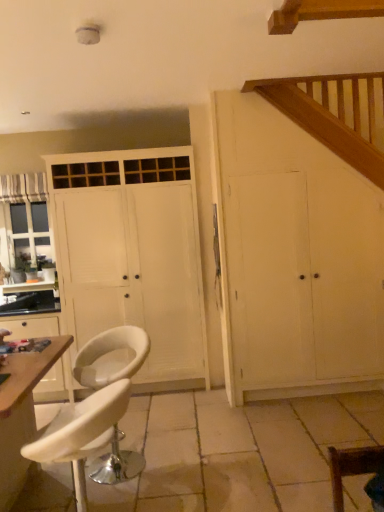
Question: Is matte white cabinet at left further to camera compared to white leather chair at lower right, which is the 3th chair from left to right?

Choices:
 (A) no
 (B) yes

Answer: (B)

Question: From the image's perspective, is matte white cabinet at left on top of white leather chair at lower right, which appears as the first chair when viewed from the right?

Choices:
 (A) yes
 (B) no

Answer: (B)

Question: From the image's perspective, is matte white cabinet at left below white leather chair at lower right, which is the first chair from front to back?

Choices:
 (A) no
 (B) yes

Answer: (B)

Question: Does matte white cabinet at left appear on the left side of white leather chair at lower right, which is the first chair from front to back?

Choices:
 (A) no
 (B) yes

Answer: (B)

Question: From a real-world perspective, is matte white cabinet at left over white leather chair at lower right, which is the 3th chair from left to right?

Choices:
 (A) no
 (B) yes

Answer: (A)

Question: Considering the positions of white leather stool at lower left, the second chair in the front-to-back sequence, and wooden table at lower left in the image, is white leather stool at lower left, the second chair in the front-to-back sequence, taller or shorter than wooden table at lower left?

Choices:
 (A) short
 (B) tall

Answer: (A)

Question: Is white leather stool at lower left, acting as the second chair starting from the back, wider or thinner than wooden table at lower left?

Choices:
 (A) wide
 (B) thin

Answer: (B)

Question: From a real-world perspective, is white leather stool at lower left, the second chair viewed from the right, above or below wooden table at lower left?

Choices:
 (A) below
 (B) above

Answer: (B)

Question: Relative to wooden table at lower left, is white leather stool at lower left, the second chair in the front-to-back sequence, in front or behind?

Choices:
 (A) behind
 (B) front

Answer: (B)

Question: Would you say white wood cupboard at right, which ranks as the second cupboard in left-to-right order, is to the left or to the right of white leather bar stool at lower left, which appears as the first chair when viewed from the left, in the picture?

Choices:
 (A) left
 (B) right

Answer: (B)

Question: From the image's perspective, relative to white leather bar stool at lower left, arranged as the third chair when viewed from the right, is white wood cupboard at right, which ranks as the second cupboard in left-to-right order, above or below?

Choices:
 (A) below
 (B) above

Answer: (B)

Question: Is white wood cupboard at right, which ranks as the second cupboard in left-to-right order, inside the boundaries of white leather bar stool at lower left, arranged as the 1th chair when viewed from the back, or outside?

Choices:
 (A) inside
 (B) outside

Answer: (B)

Question: Looking at their shapes, would you say white wood cupboard at right, which ranks as the second cupboard in left-to-right order, is wider or thinner than white leather bar stool at lower left, which appears as the first chair when viewed from the left?

Choices:
 (A) thin
 (B) wide

Answer: (B)

Question: Is matte white cabinet at left bigger or smaller than white wood cupboard at right, which ranks as the second cupboard in left-to-right order?

Choices:
 (A) small
 (B) big

Answer: (A)

Question: Looking at their shapes, would you say matte white cabinet at left is wider or thinner than white wood cupboard at right, the 1th cupboard viewed from the right?

Choices:
 (A) wide
 (B) thin

Answer: (A)